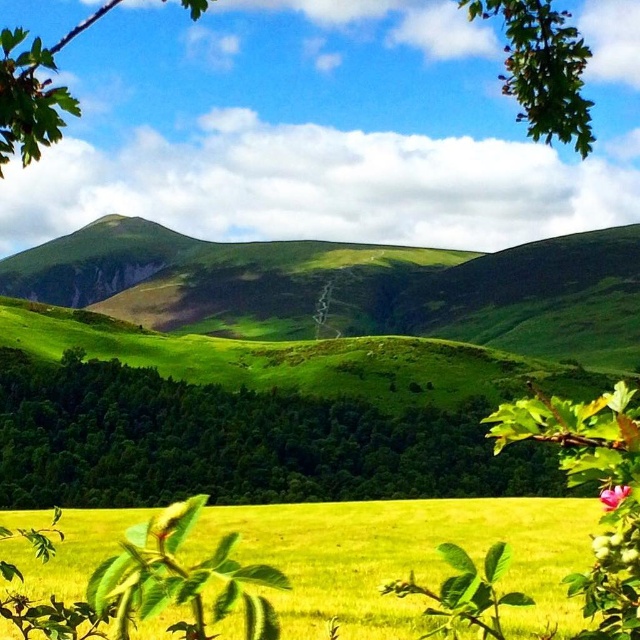
Question: Can you confirm if green leafy branch at upper center is positioned to the right of pink matte flower at lower right?

Choices:
 (A) yes
 (B) no

Answer: (B)

Question: Which point is closer to the camera?

Choices:
 (A) (600, 500)
 (B) (250, 547)

Answer: (A)

Question: Which point is closer to the camera?

Choices:
 (A) green leafy branch at upper center
 (B) green leafy tree at lower left
 (C) yellow grass at center

Answer: (C)

Question: Can you confirm if green leafy tree at lower left is positioned below yellow grass at center?

Choices:
 (A) yes
 (B) no

Answer: (A)

Question: Which of these objects is positioned closest to the green leafy branch at upper center?

Choices:
 (A) green leafy tree at lower left
 (B) pink matte flower at lower right
 (C) yellow grass at center

Answer: (A)

Question: Is yellow grass at center to the right of green leafy branch at upper center from the viewer's perspective?

Choices:
 (A) yes
 (B) no

Answer: (A)